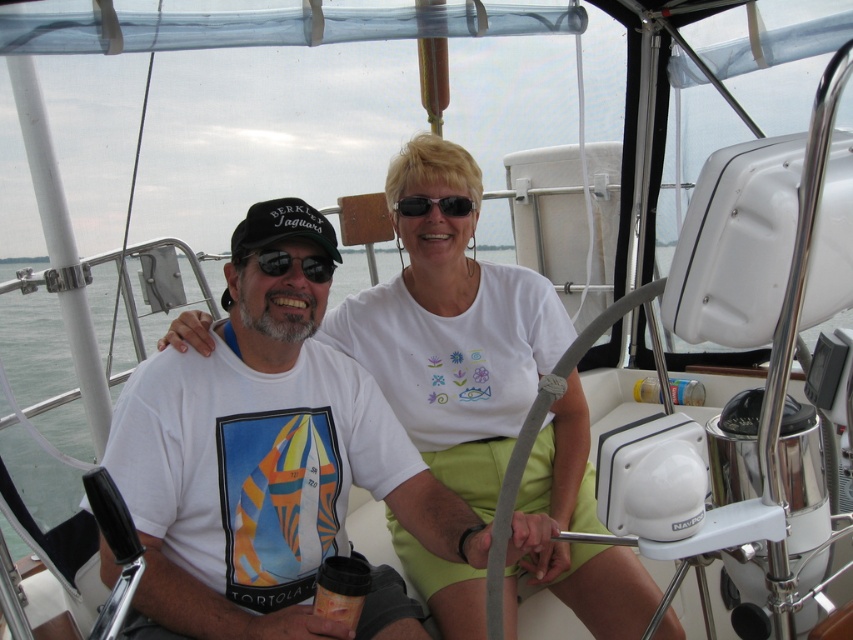
Who is positioned more to the left, white matte t-shirt at center or black plastic sunglasses at center?

black plastic sunglasses at center

Between white matte t-shirt at center and black plastic sunglasses at center, which one is positioned lower?

white matte t-shirt at center

Identify the location of white matte t-shirt at center. (206, 522).

Does white matte t-shirt at center have a lesser height compared to black plastic sunglasses at upper center?

Incorrect, white matte t-shirt at center's height does not fall short of black plastic sunglasses at upper center's.

Locate an element on the screen. white matte t-shirt at center is located at coordinates (206, 522).

Between point (135, 593) and point (402, 211), which one is positioned in front?

Point (135, 593) is more forward.

This screenshot has width=853, height=640. Identify the location of white matte t-shirt at center. (206, 522).

Is black plastic sunglasses at center thinner than black plastic sunglasses at upper center?

Incorrect, black plastic sunglasses at center's width is not less than black plastic sunglasses at upper center's.

Is point (308, 260) farther from viewer compared to point (397, 212)?

No, it is in front of (397, 212).

The height and width of the screenshot is (640, 853). Identify the location of black plastic sunglasses at center. (271, 260).